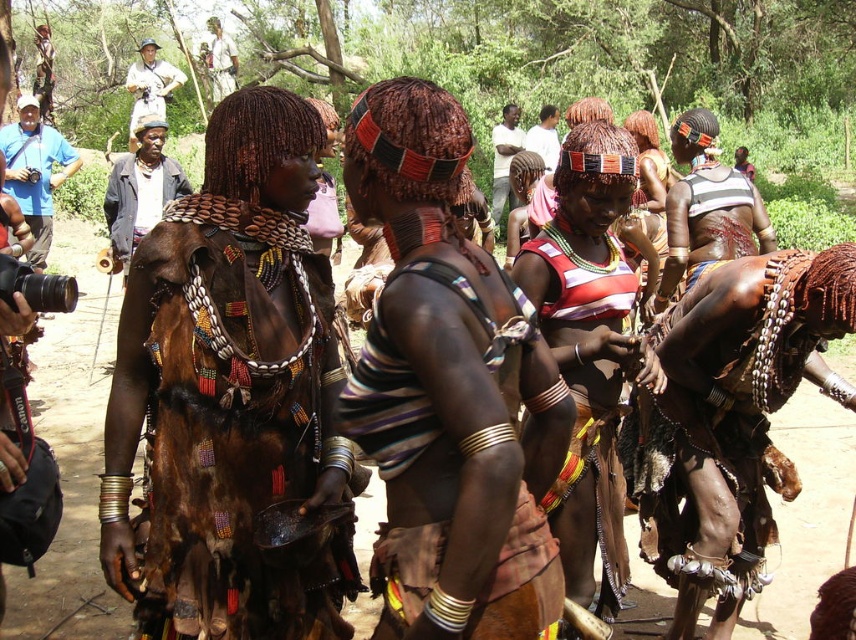
Which of these two, matte brown leather skirt at center or white shirt at center, stands taller?

With more height is white shirt at center.

Locate an element on the screen. matte brown leather skirt at center is located at coordinates (449, 392).

Where is `matte brown leather skirt at center`? The image size is (856, 640). matte brown leather skirt at center is located at coordinates (449, 392).

Can you confirm if white cotton shirt at upper center is smaller than white shirt at center?

Yes, white cotton shirt at upper center is smaller than white shirt at center.

Is white cotton shirt at upper center to the right of white shirt at center from the viewer's perspective?

No, white cotton shirt at upper center is not to the right of white shirt at center.

Locate an element on the screen. This screenshot has height=640, width=856. white cotton shirt at upper center is located at coordinates (223, 64).

Does point (15, 188) lie in front of point (688, 208)?

No, it is not.

Between blue fabric camera at left and striped fabric top at center, which one is positioned higher?

blue fabric camera at left is higher up.

Where is `blue fabric camera at left`? The width and height of the screenshot is (856, 640). blue fabric camera at left is located at coordinates (34, 179).

Image resolution: width=856 pixels, height=640 pixels. I want to click on blue fabric camera at left, so click(34, 179).